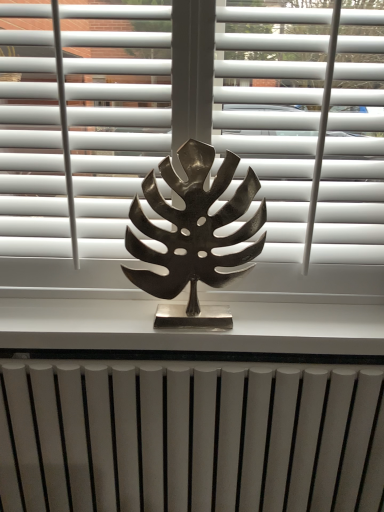
Question: Is white matte radiator at bottom looking in the opposite direction of metallic silver leaf at center?

Choices:
 (A) yes
 (B) no

Answer: (B)

Question: Could you tell me if white matte radiator at bottom is turned towards metallic silver leaf at center?

Choices:
 (A) no
 (B) yes

Answer: (A)

Question: Does white matte radiator at bottom have a larger size compared to metallic silver leaf at center?

Choices:
 (A) yes
 (B) no

Answer: (A)

Question: Is white matte radiator at bottom positioned in front of metallic silver leaf at center?

Choices:
 (A) no
 (B) yes

Answer: (A)

Question: From the image's perspective, is white matte radiator at bottom beneath metallic silver leaf at center?

Choices:
 (A) yes
 (B) no

Answer: (A)

Question: Relative to white matte radiator at bottom, is metallic silver leaf at center in front or behind?

Choices:
 (A) behind
 (B) front

Answer: (B)

Question: In terms of width, does metallic silver leaf at center look wider or thinner when compared to white matte radiator at bottom?

Choices:
 (A) wide
 (B) thin

Answer: (B)

Question: Is metallic silver leaf at center to the left or to the right of white matte radiator at bottom in the image?

Choices:
 (A) right
 (B) left

Answer: (A)

Question: Is metallic silver leaf at center inside the boundaries of white matte radiator at bottom, or outside?

Choices:
 (A) inside
 (B) outside

Answer: (B)

Question: In terms of width, does white matte blind at upper center look wider or thinner when compared to metallic silver leaf at center?

Choices:
 (A) thin
 (B) wide

Answer: (B)

Question: From the image's perspective, is white matte blind at upper center located above or below metallic silver leaf at center?

Choices:
 (A) above
 (B) below

Answer: (A)

Question: From a real-world perspective, relative to metallic silver leaf at center, is white matte blind at upper center vertically above or below?

Choices:
 (A) above
 (B) below

Answer: (A)

Question: Is point [281, 192] closer or farther from the camera than point [19, 122]?

Choices:
 (A) closer
 (B) farther

Answer: (B)

Question: From the image's perspective, is metallic silver leaf at center positioned above or below white matte blind at upper center?

Choices:
 (A) below
 (B) above

Answer: (A)

Question: Considering the positions of metallic silver leaf at center and white matte blind at upper center in the image, is metallic silver leaf at center taller or shorter than white matte blind at upper center?

Choices:
 (A) tall
 (B) short

Answer: (A)